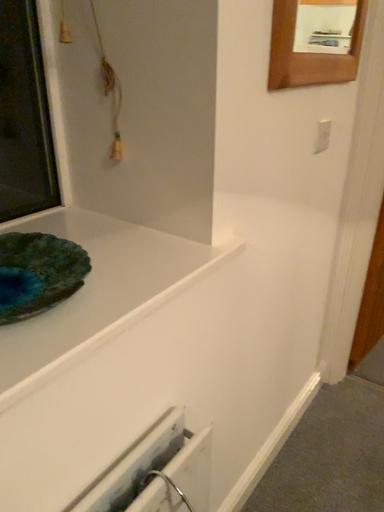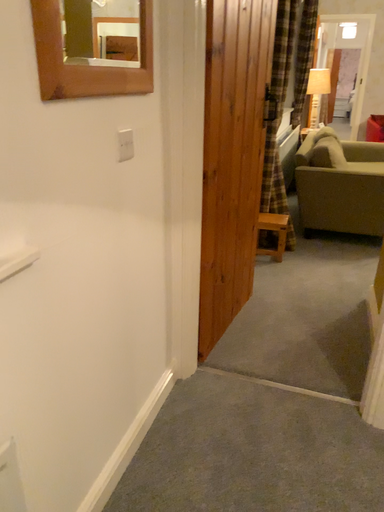
Question: How did the camera likely rotate when shooting the video?

Choices:
 (A) rotated right
 (B) rotated left

Answer: (A)